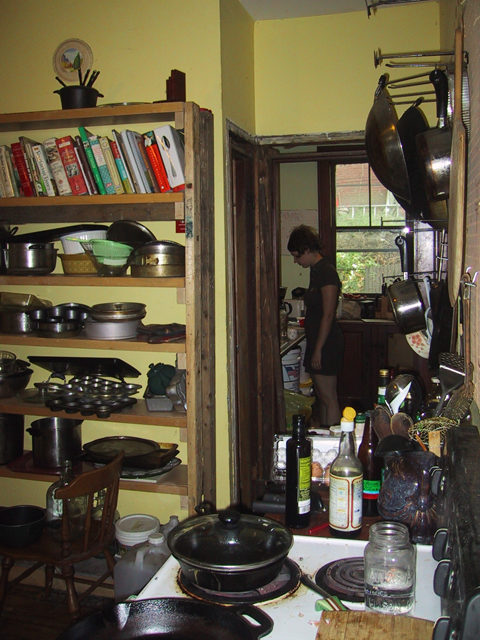
Identify the location of burner. The height and width of the screenshot is (640, 480). (275, 589), (340, 573).